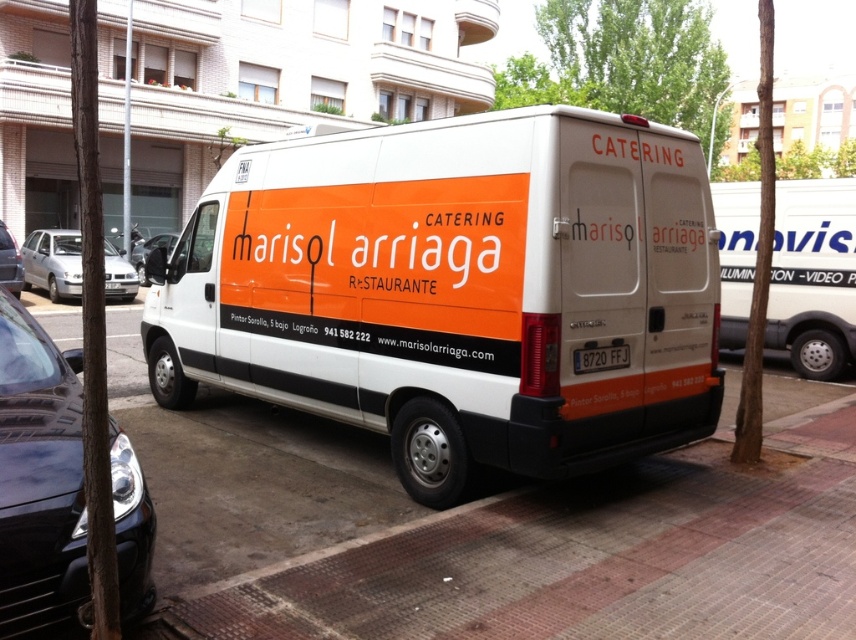
Is white matte van at center above black glossy car at lower left?

Indeed, white matte van at center is positioned over black glossy car at lower left.

Is white matte van at center wider than black glossy car at lower left?

Indeed, white matte van at center has a greater width compared to black glossy car at lower left.

The height and width of the screenshot is (640, 856). What are the coordinates of `white matte van at center` in the screenshot? It's located at (456, 289).

Can you confirm if black glossy car at lower left is positioned to the right of matte black van at center?

Yes, black glossy car at lower left is to the right of matte black van at center.

Can you confirm if black glossy car at lower left is positioned above matte black van at center?

Actually, black glossy car at lower left is below matte black van at center.

Measure the distance between black glossy car at lower left and camera.

black glossy car at lower left and camera are 2.46 meters apart.

The image size is (856, 640). What are the coordinates of `black glossy car at lower left` in the screenshot? It's located at (39, 477).

The width and height of the screenshot is (856, 640). Describe the element at coordinates (813, 275) in the screenshot. I see `white matte van at right` at that location.

Between point (833, 301) and point (69, 272), which one is positioned behind?

The point (69, 272) is more distant.

Locate an element on the screen. The height and width of the screenshot is (640, 856). white matte van at right is located at coordinates (813, 275).